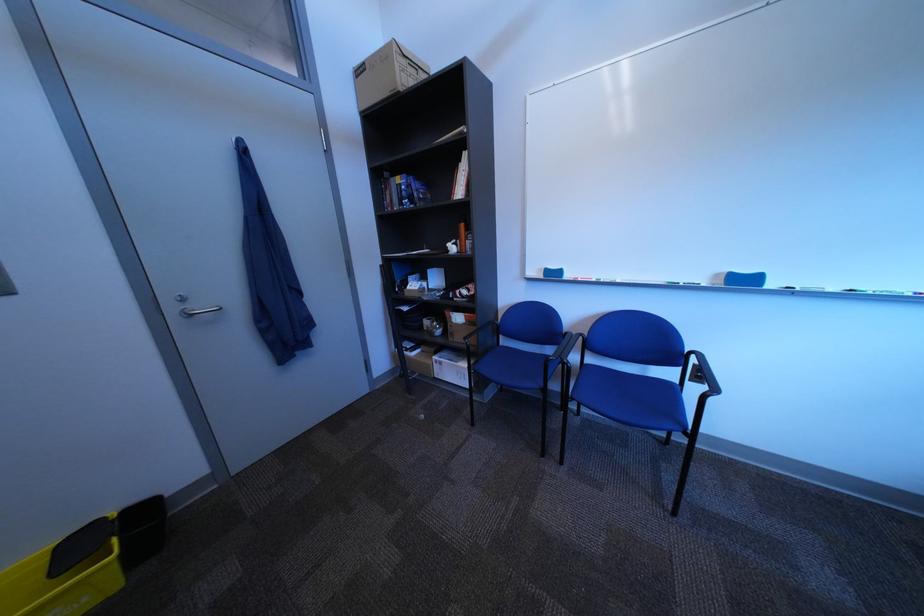
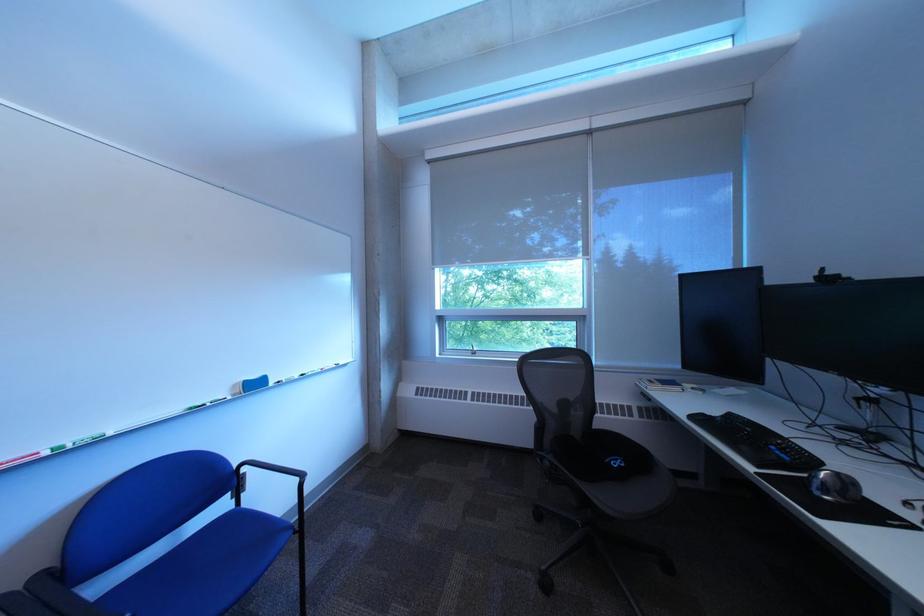
Find the pixel in the second image that matches point 733,277 in the first image.

(249, 387)